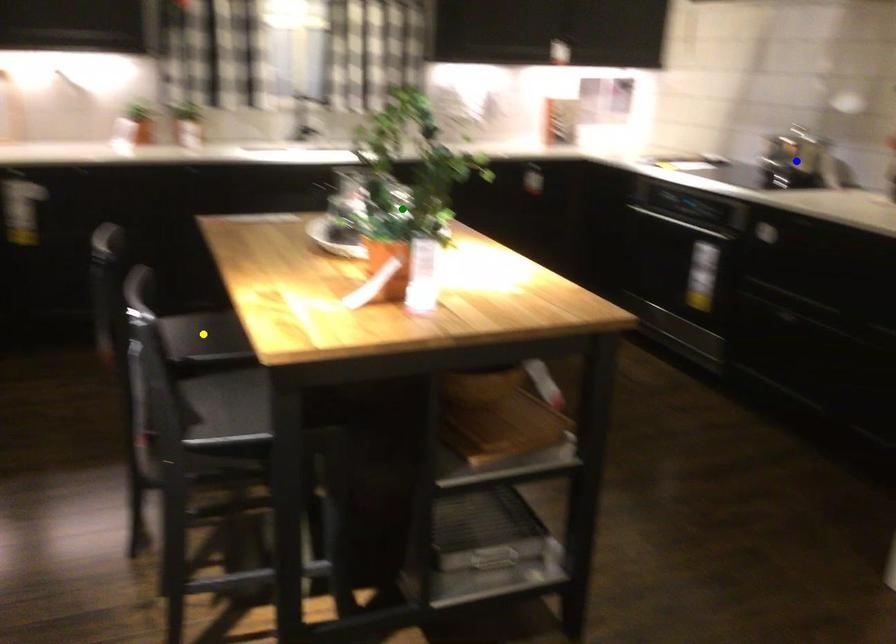
Order these from nearest to farthest:
A) yellow point
B) blue point
C) green point

yellow point
green point
blue point